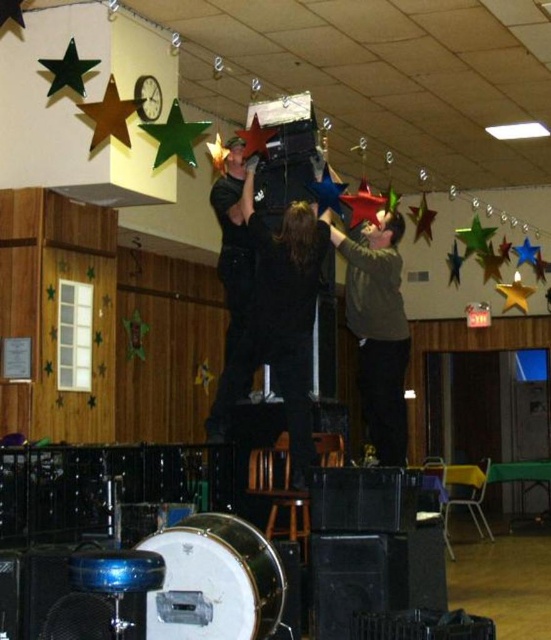
Is point (169, 145) positioned in front of point (269, 131)?

Yes, it is in front of point (269, 131).

I want to click on green glossy star at upper center, so click(x=175, y=136).

Which is more to the left, brushed silver drum at lower left or metallic gold star at upper center?

Positioned to the left is brushed silver drum at lower left.

Does brushed silver drum at lower left lie in front of metallic gold star at upper center?

That is True.

Locate an element on the screen. The image size is (551, 640). brushed silver drum at lower left is located at coordinates (214, 580).

The height and width of the screenshot is (640, 551). In order to click on brushed silver drum at lower left in this screenshot , I will do click(x=214, y=580).

Is dark blue uniform at center wider than metallic blue star at center?

Yes, dark blue uniform at center is wider than metallic blue star at center.

Between dark blue uniform at center and metallic blue star at center, which one appears on the right side from the viewer's perspective?

Positioned to the right is metallic blue star at center.

Who is more distant from viewer, (234,198) or (310,193)?

The point (234,198) is behind.

The width and height of the screenshot is (551, 640). In order to click on dark blue uniform at center in this screenshot , I will do `click(233, 282)`.